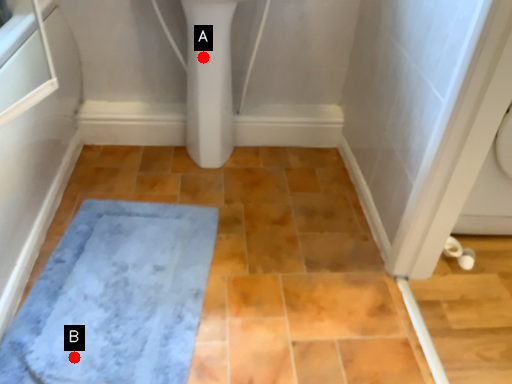
Question: Two points are circled on the image, labeled by A and B beside each circle. Which of the following is the farthest from the observer?

Choices:
 (A) A is further
 (B) B is further

Answer: (A)